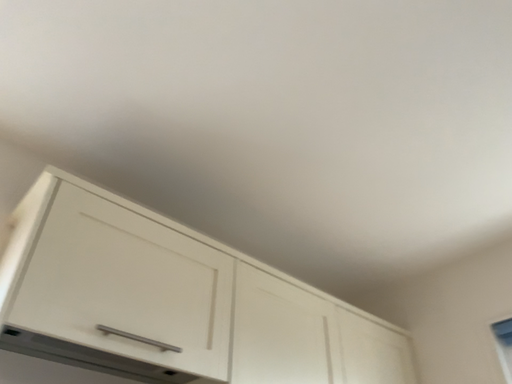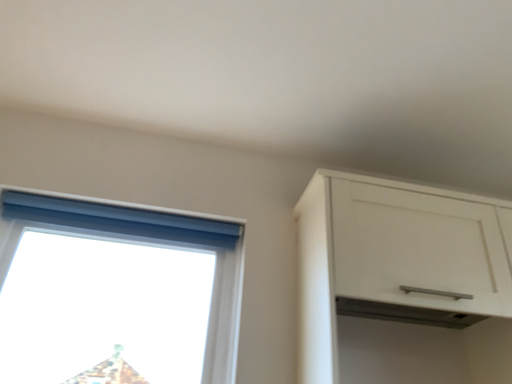
Question: Which way did the camera rotate in the video?

Choices:
 (A) rotated downward
 (B) rotated upward

Answer: (A)